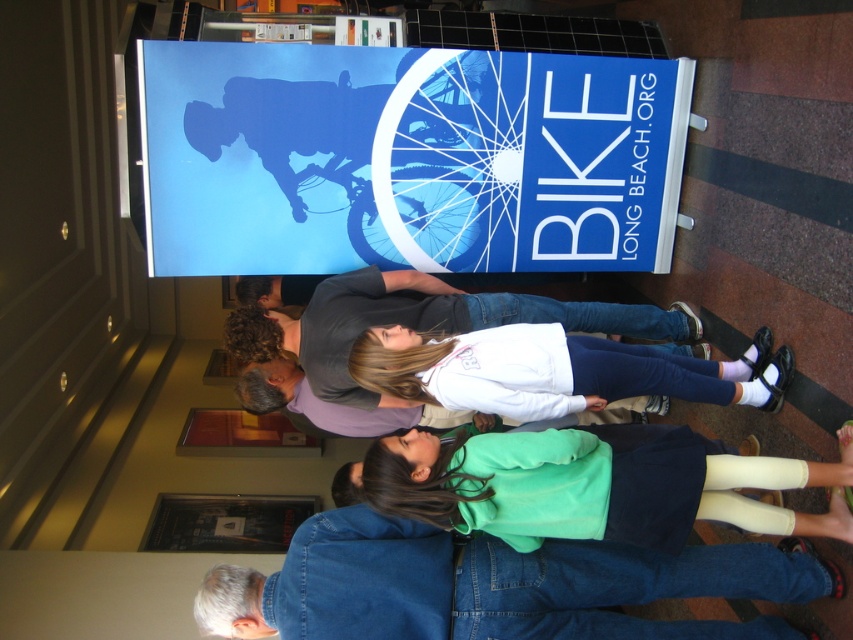
Consider the image. Who is shorter, denim jeans at lower center or white matte shirt at center?

denim jeans at lower center

Can you confirm if denim jeans at lower center is shorter than white matte shirt at center?

Correct, denim jeans at lower center is not as tall as white matte shirt at center.

Where is `denim jeans at lower center`? The width and height of the screenshot is (853, 640). denim jeans at lower center is located at coordinates (492, 586).

Identify the location of denim jeans at lower center. The width and height of the screenshot is (853, 640). (492, 586).

Find the location of a particular element. green fleece sweatshirt at center is located at coordinates (585, 486).

Locate an element on the screen. The image size is (853, 640). green fleece sweatshirt at center is located at coordinates (585, 486).

Which is below, green fleece sweatshirt at center or white matte shirt at center?

Positioned lower is green fleece sweatshirt at center.

Does point (380, 497) come in front of point (445, 333)?

Yes, it is in front of point (445, 333).

The width and height of the screenshot is (853, 640). I want to click on green fleece sweatshirt at center, so click(x=585, y=486).